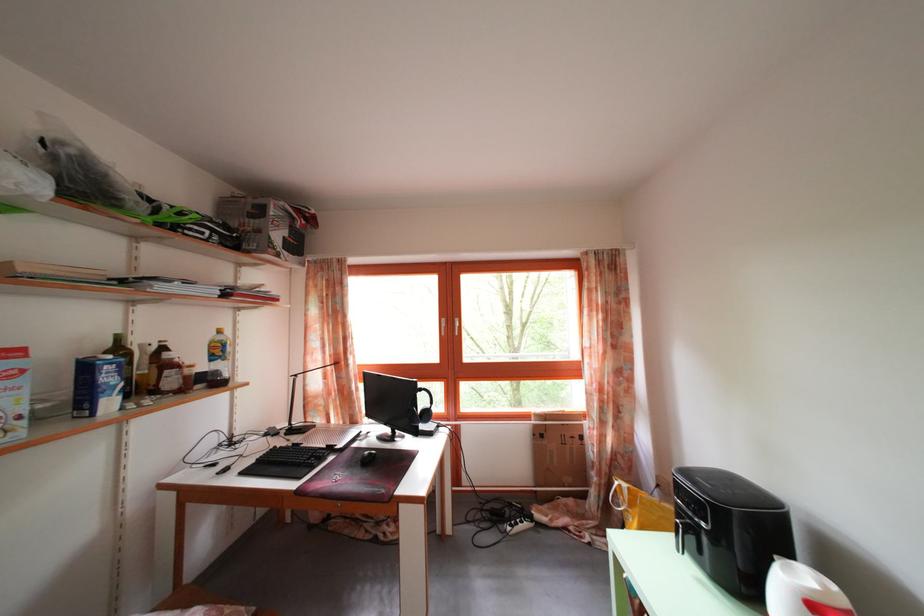
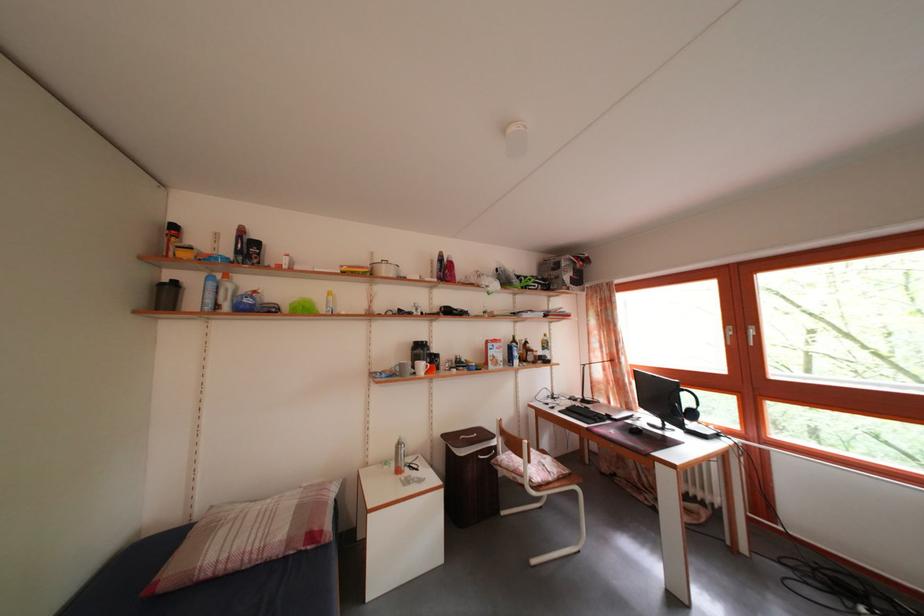
Question: Based on the continuous images, in which direction is the camera rotating? Reply with the corresponding letter.

Choices:
 (A) Left
 (B) Right
 (C) Up
 (D) Down

Answer: (A)